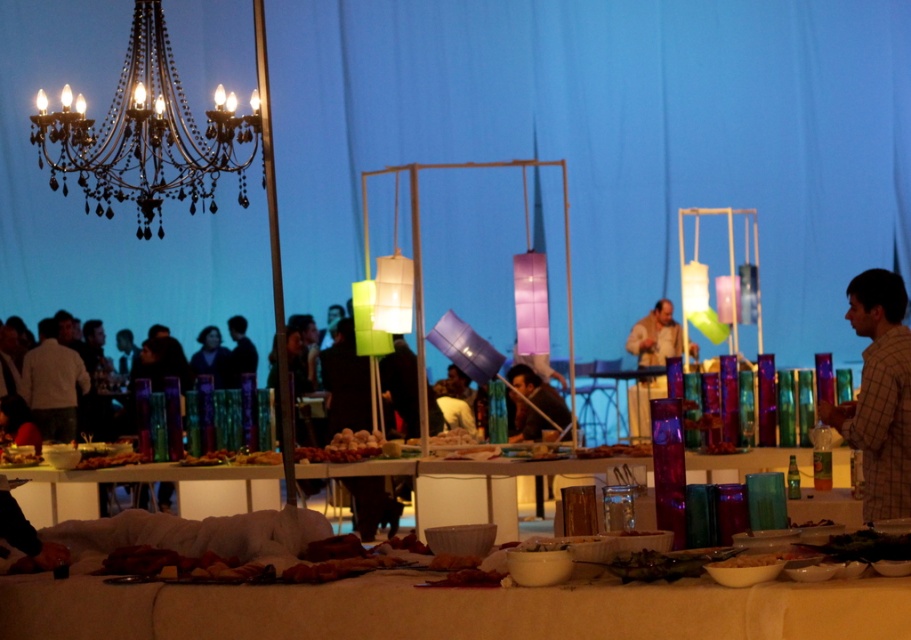
Does white matte table at lower center lie in front of white glossy bowl at center?

Yes, white matte table at lower center is closer to the viewer.

Which is behind, point (393, 576) or point (408, 442)?

Positioned behind is point (408, 442).

Find the location of `white matte table at lower center`. white matte table at lower center is located at coordinates (449, 609).

Which is below, white matte table at lower center or black crystal chandelier at upper left?

white matte table at lower center

Who is more distant from viewer, (252, 605) or (101, 140)?

Point (101, 140)

The image size is (911, 640). What do you see at coordinates (449, 609) in the screenshot?
I see `white matte table at lower center` at bounding box center [449, 609].

Find the location of `white matte table at lower center`. white matte table at lower center is located at coordinates (449, 609).

Is black crystal chandelier at upper left to the right of white glossy bowl at center from the viewer's perspective?

Incorrect, black crystal chandelier at upper left is not on the right side of white glossy bowl at center.

Which of these two, black crystal chandelier at upper left or white glossy bowl at center, stands taller?

With more height is black crystal chandelier at upper left.

Find the location of a particular element. The width and height of the screenshot is (911, 640). black crystal chandelier at upper left is located at coordinates (146, 134).